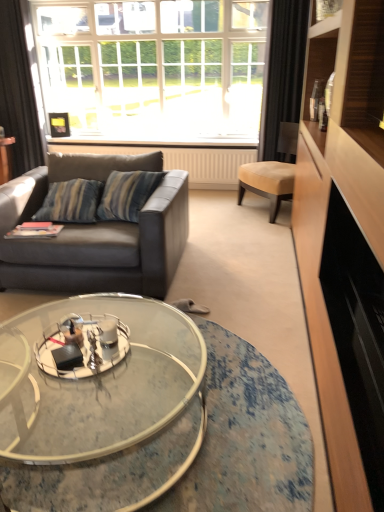
Question: Would you consider matte gray leather couch at left to be distant from black fabric curtain at upper right, which is the 2th curtain from left to right?

Choices:
 (A) yes
 (B) no

Answer: (A)

Question: Is matte gray leather couch at left positioned with its back to black fabric curtain at upper right, the first curtain in the right-to-left sequence?

Choices:
 (A) yes
 (B) no

Answer: (B)

Question: Does matte gray leather couch at left have a larger size compared to black fabric curtain at upper right, the first curtain in the right-to-left sequence?

Choices:
 (A) no
 (B) yes

Answer: (B)

Question: Is matte gray leather couch at left to the left of black fabric curtain at upper right, the first curtain in the right-to-left sequence, from the viewer's perspective?

Choices:
 (A) no
 (B) yes

Answer: (B)

Question: Is matte gray leather couch at left shorter than black fabric curtain at upper right, the first curtain in the right-to-left sequence?

Choices:
 (A) no
 (B) yes

Answer: (B)

Question: From the image's perspective, is matte gray leather couch at left located beneath black fabric curtain at upper right, the first curtain in the right-to-left sequence?

Choices:
 (A) yes
 (B) no

Answer: (A)

Question: From a real-world perspective, is clear glass coffee table at center positioned under white textured radiator at center based on gravity?

Choices:
 (A) no
 (B) yes

Answer: (B)

Question: Considering the relative positions of clear glass coffee table at center and white textured radiator at center in the image provided, is clear glass coffee table at center to the right of white textured radiator at center from the viewer's perspective?

Choices:
 (A) no
 (B) yes

Answer: (B)

Question: Is clear glass coffee table at center next to white textured radiator at center?

Choices:
 (A) yes
 (B) no

Answer: (B)

Question: From the image's perspective, is clear glass coffee table at center below white textured radiator at center?

Choices:
 (A) no
 (B) yes

Answer: (B)

Question: Is clear glass coffee table at center positioned before white textured radiator at center?

Choices:
 (A) yes
 (B) no

Answer: (A)

Question: Is clear glass coffee table at center thinner than white textured radiator at center?

Choices:
 (A) yes
 (B) no

Answer: (B)

Question: Does white textured radiator at center turn towards suede-like tan chair at right?

Choices:
 (A) no
 (B) yes

Answer: (B)